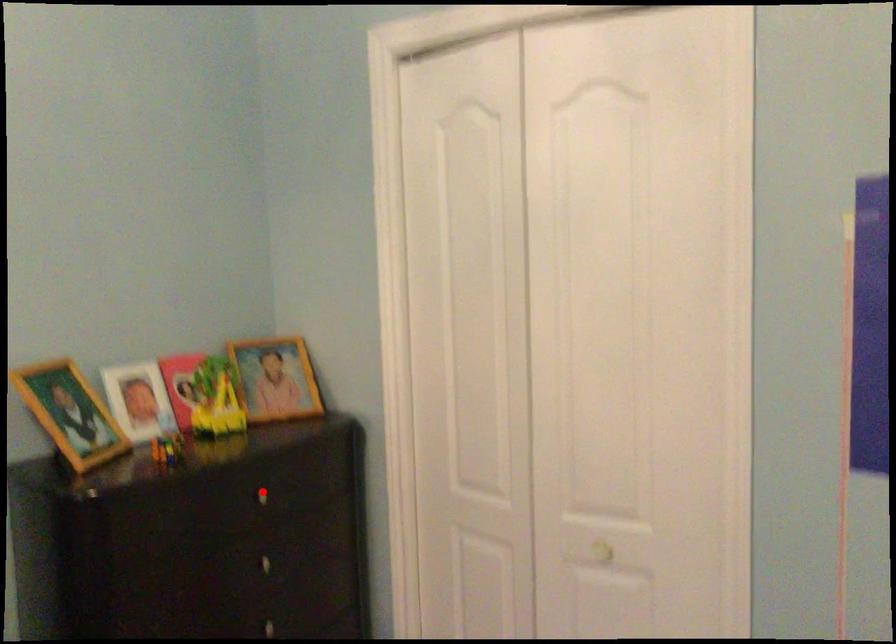
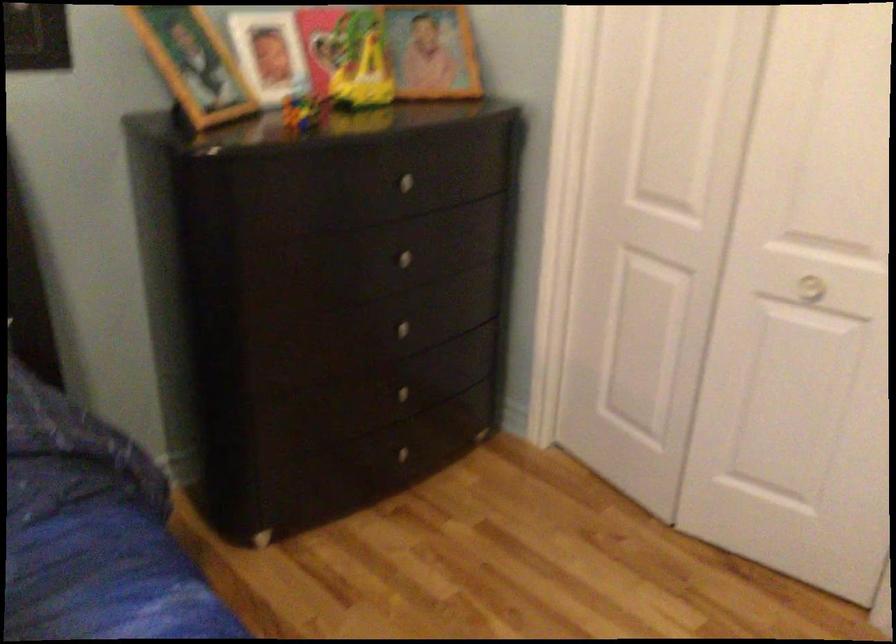
Where in the second image is the point corresponding to the highlighted location from the first image?

(408, 178)